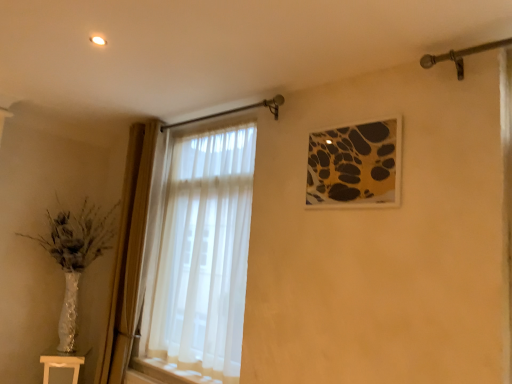
Question: From a real-world perspective, is gold-framed artwork at upper right above or below light wood table at lower left?

Choices:
 (A) above
 (B) below

Answer: (A)

Question: Considering their positions, is gold-framed artwork at upper right located in front of or behind light wood table at lower left?

Choices:
 (A) front
 (B) behind

Answer: (A)

Question: Looking at the image, does gold-framed artwork at upper right seem bigger or smaller compared to light wood table at lower left?

Choices:
 (A) big
 (B) small

Answer: (B)

Question: Considering the relative positions of light wood table at lower left and gold-framed artwork at upper right in the image provided, is light wood table at lower left to the left or to the right of gold-framed artwork at upper right?

Choices:
 (A) right
 (B) left

Answer: (B)

Question: Is light wood table at lower left in front of or behind gold-framed artwork at upper right in the image?

Choices:
 (A) front
 (B) behind

Answer: (B)

Question: From the image's perspective, is light wood table at lower left located above or below gold-framed artwork at upper right?

Choices:
 (A) above
 (B) below

Answer: (B)

Question: From a real-world perspective, is light wood table at lower left above or below gold-framed artwork at upper right?

Choices:
 (A) below
 (B) above

Answer: (A)